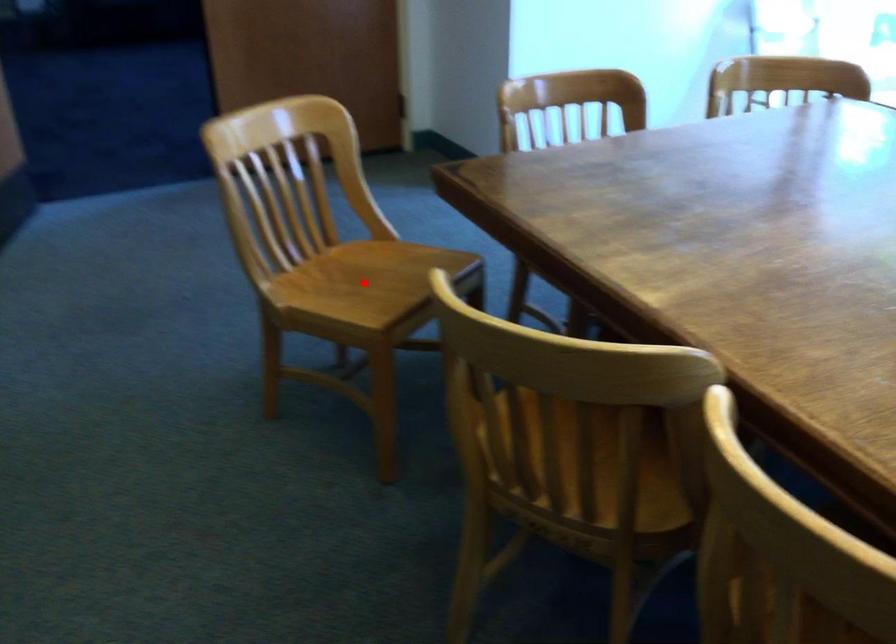
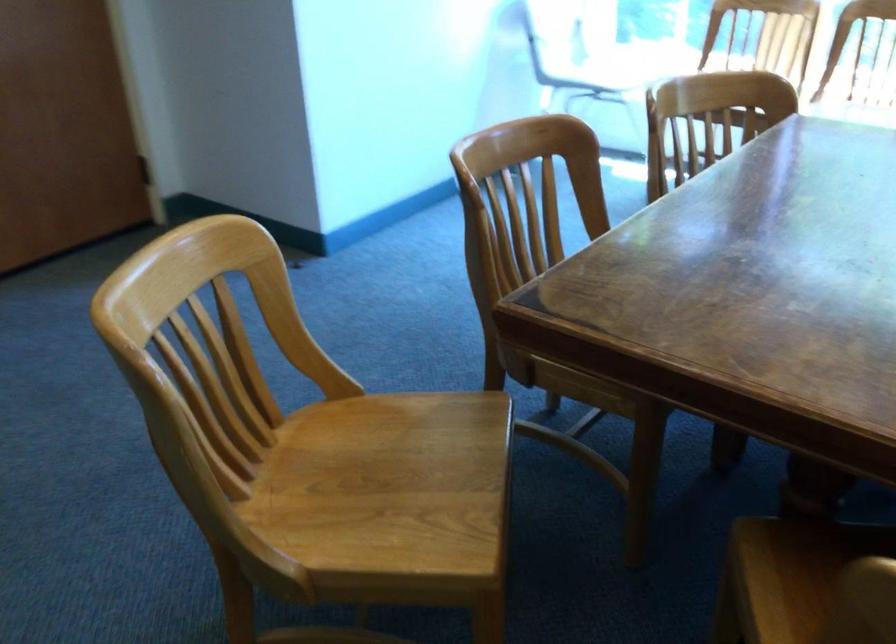
Question: I am providing you with two images of the same scene from different viewpoints. In image1, a red point is highlighted. Considering the same 3D point in image2, which of the following is correct?

Choices:
 (A) It is closer
 (B) It is farther

Answer: (A)